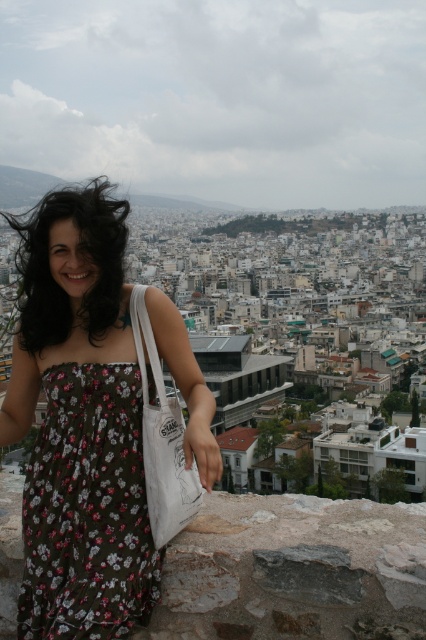
Based on the photo, you are a photographer trying to capture the woman in the scene. You want to ensure that both the floral print fabric dress at center and the dark brown silky hair at left are clearly visible in the frame. Based on their positions, which object should you focus on first to ensure both are in focus?

The dark brown silky hair at left is above the floral print fabric dress at center, so focusing on the dark brown silky hair at left first will help ensure both are in focus since it is higher up.

You are a photographer positioned at the center of the scene. You want to capture a closeup shot of the dark brown silky hair at left without moving your camera. Is the floral cotton dress at center blocking your view?

The distance between the floral cotton dress at center and the dark brown silky hair at left is 39.18 meters, so the floral cotton dress at center is not blocking the view of the dark brown silky hair at left.

You are a photographer who wants to capture the woman in the floral cotton dress at center and the floral print fabric dress at center in a single shot. Which dress will appear larger in the photo?

The floral cotton dress at center will appear larger in the photo because it is much taller than the floral print fabric dress at center.